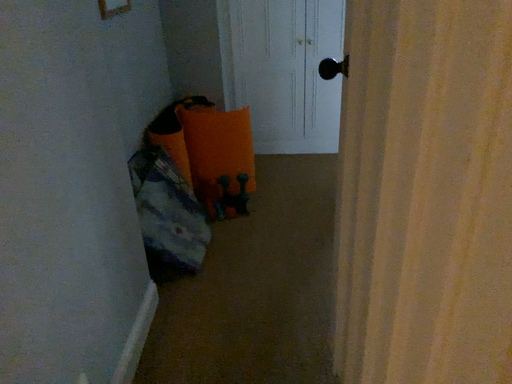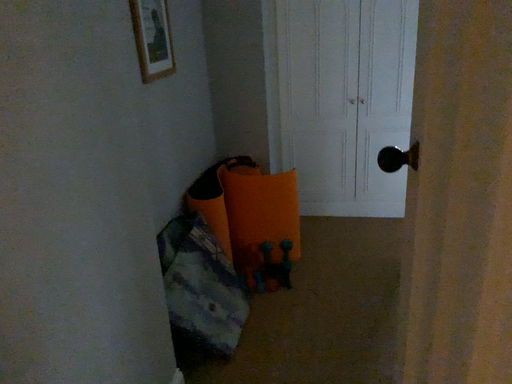
Question: How did the camera likely rotate when shooting the video?

Choices:
 (A) rotated upward
 (B) rotated downward

Answer: (A)